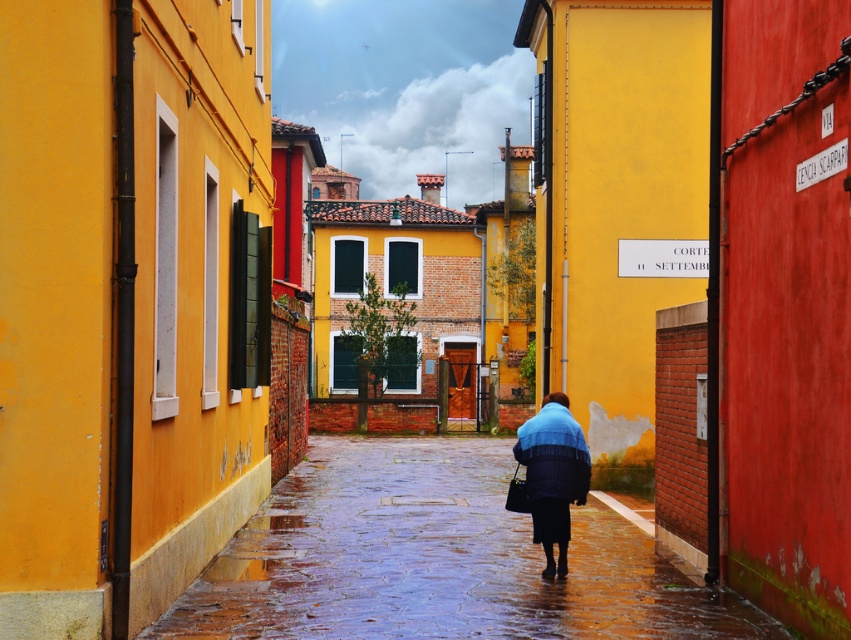
You are a tourist holding an umbrella and standing in the middle of the narrow cobblestone alleyway. You notice the wet stone pavement at center and the blue fuzzy coat at center. Which object is closer to you?

The wet stone pavement at center is closer to the viewer than the blue fuzzy coat at center.